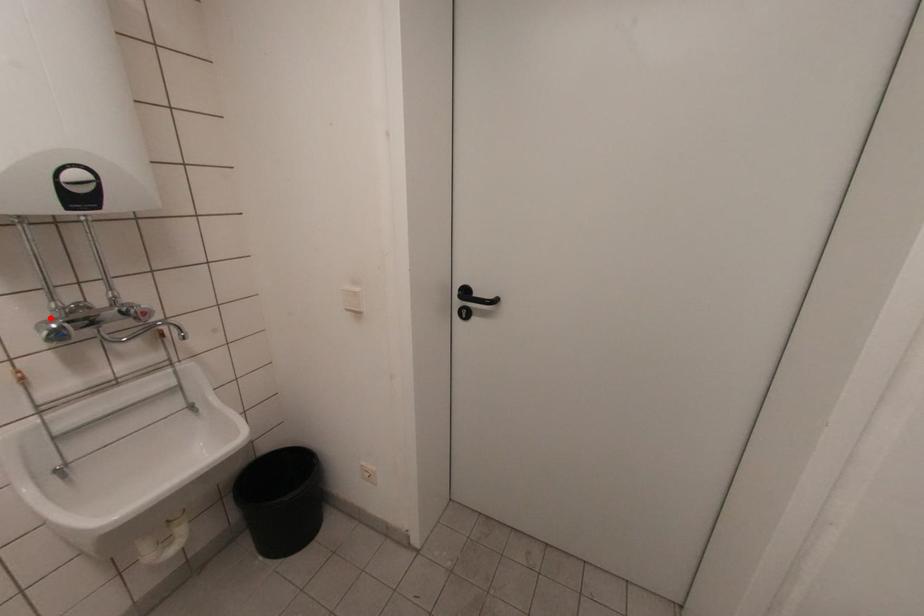
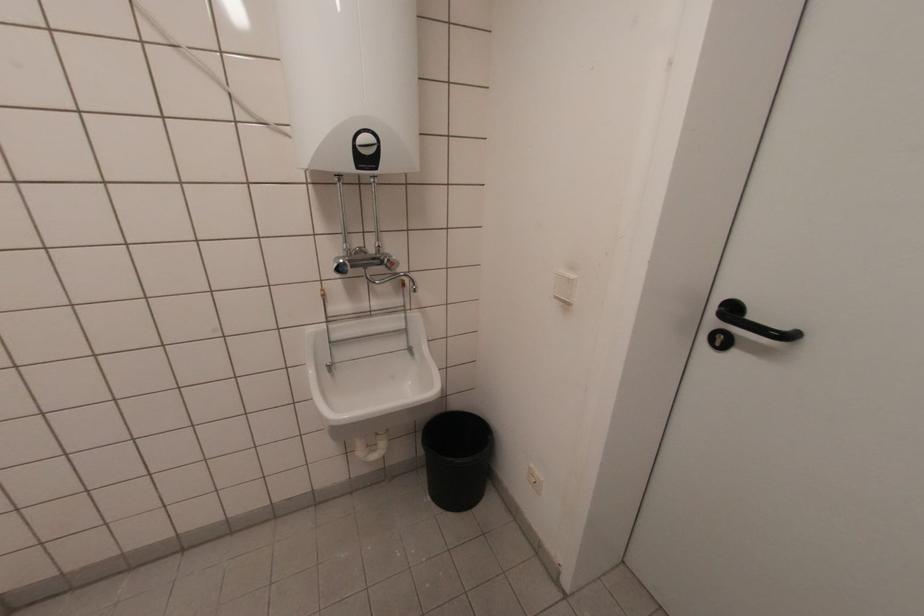
The point at the highlighted location is marked in the first image. Where is the corresponding point in the second image?

(343, 254)